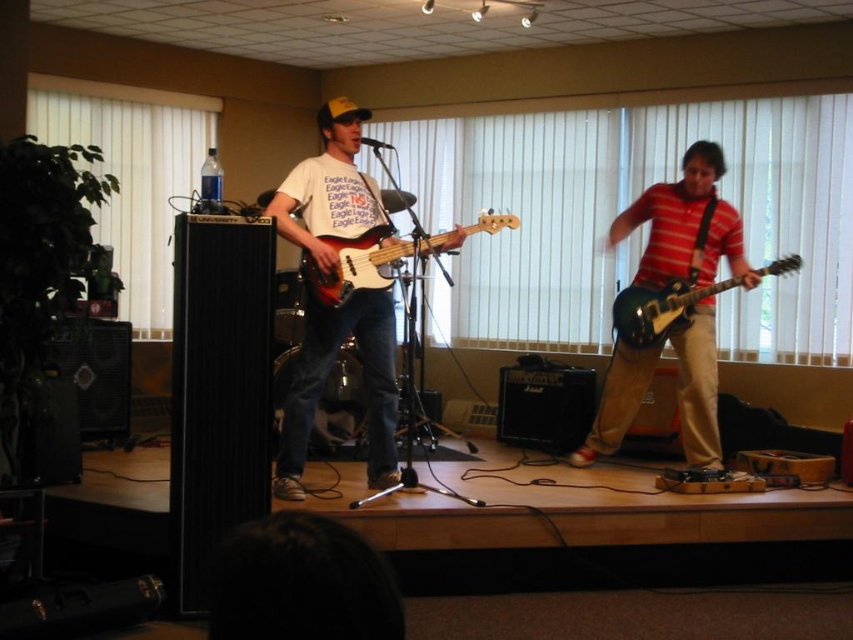
Question: Does matte white t-shirt at center have a lesser width compared to glossy green electric guitar at right?

Choices:
 (A) no
 (B) yes

Answer: (B)

Question: Is matte white t-shirt at center above glossy green electric guitar at right?

Choices:
 (A) yes
 (B) no

Answer: (B)

Question: Estimate the real-world distances between objects in this image. Which object is farther from the glossy green electric guitar at right?

Choices:
 (A) glossy wood bass guitar at center
 (B) matte white t-shirt at center
 (C) green glossy electric guitar at center

Answer: (B)

Question: Is green glossy electric guitar at center to the left of glossy green electric guitar at right from the viewer's perspective?

Choices:
 (A) yes
 (B) no

Answer: (A)

Question: Which object is the farthest from the matte white t-shirt at center?

Choices:
 (A) glossy wood bass guitar at center
 (B) glossy green electric guitar at right
 (C) green glossy electric guitar at center

Answer: (C)

Question: Which object appears farthest from the camera in this image?

Choices:
 (A) glossy wood bass guitar at center
 (B) glossy green electric guitar at right
 (C) green glossy electric guitar at center

Answer: (C)